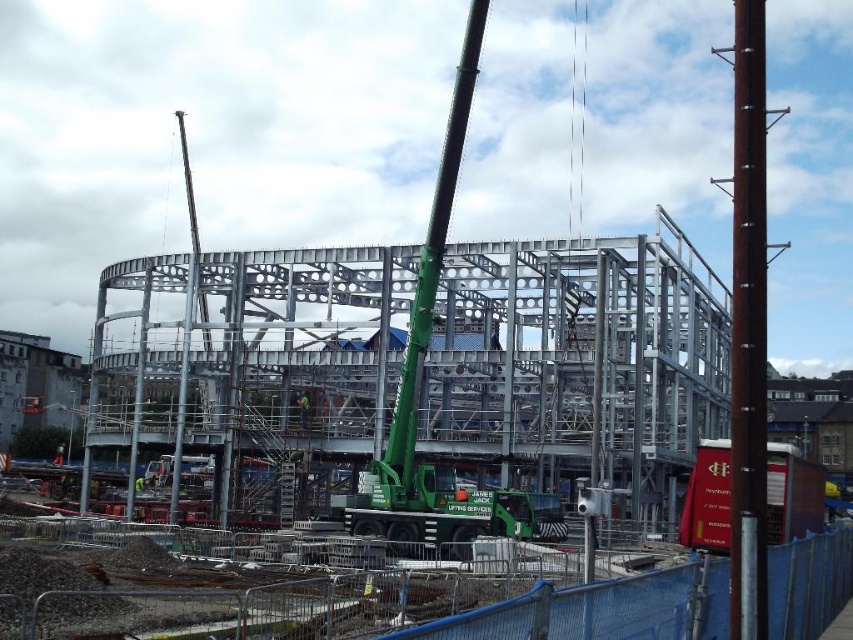
Question: Can you confirm if brown wooden pole at right is thinner than green fabric construction worker at center?

Choices:
 (A) no
 (B) yes

Answer: (A)

Question: Is brown wooden pole at right below green metallic crane at center?

Choices:
 (A) no
 (B) yes

Answer: (A)

Question: Which object is farther from the camera taking this photo?

Choices:
 (A) brown wooden pole at right
 (B) green fabric construction worker at center

Answer: (B)

Question: Estimate the real-world distances between objects in this image. Which object is closer to the green fabric construction worker at center?

Choices:
 (A) brown wooden pole at right
 (B) green metallic crane at center

Answer: (B)

Question: Which object is the farthest from the brown wooden pole at right?

Choices:
 (A) green fabric construction worker at center
 (B) green metallic crane at center

Answer: (A)

Question: Can you confirm if green metallic crane at center is positioned to the right of green fabric construction worker at center?

Choices:
 (A) yes
 (B) no

Answer: (A)